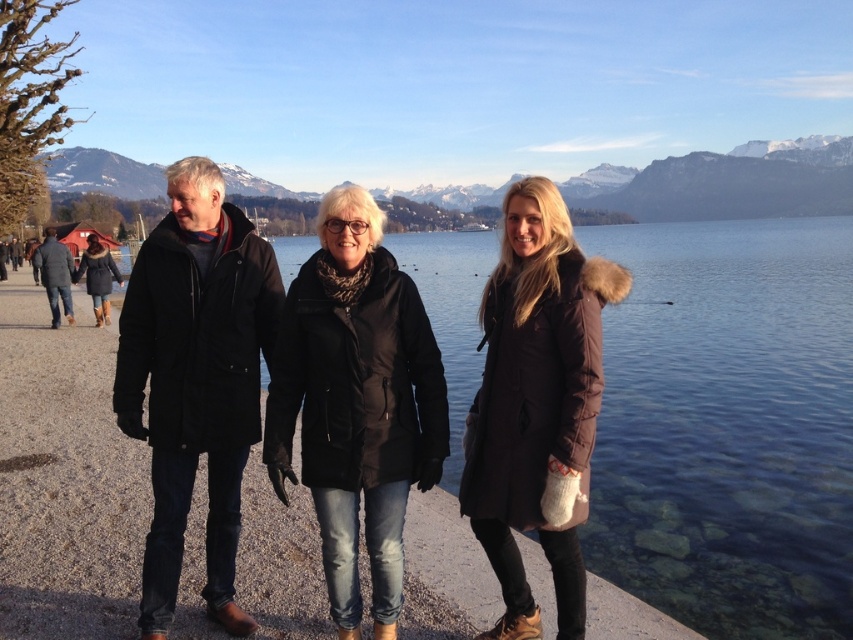
You are a photographer standing on the lakeside path. You want to take a photo of the black matte jacket at center and the dark gray coat at left. Which one should you focus on first if you want to capture both in the same frame?

The black matte jacket at center is below the dark gray coat at left, so you should focus on the dark gray coat at left first to ensure both are in the frame.

You are standing on the paved path and want to hand a map to the person wearing the matte black jackets at center. However, there is also a person wearing a black matte jacket at center in front of you. Which jacket is lower and closer to you?

The matte black jackets at center is located below the black matte jacket at center, so the matte black jackets at center is lower and closer to you.